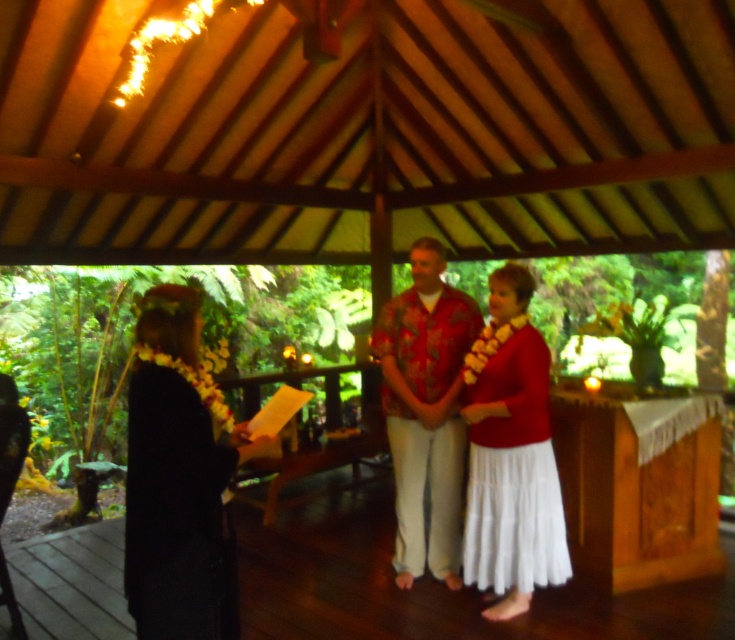
You are standing at the wooden pavilion and want to determine which of the two points, point (139, 572) or point (539, 371), is closer to you. Based on the scene description, which point is nearer?

Point (139, 572) is closer to the viewer than point (539, 371).

Based on the photo, you are attending a cultural ceremony at the wooden pavilion. You see two people wearing the black fabric dress at left and the hawaiian print shirt at center. Which one is positioned more to the left side of the scene?

The black fabric dress at left is positioned more to the left side of the scene compared to the hawaiian print shirt at center.

You are organizing a cultural event and need to arrange seating based on the space each attendee occupies. The black fabric dress at left and the hawaiian print shirt at center are two attendees. Which attendee requires more seating space?

Answer: The hawaiian print shirt at center requires more seating space because it occupies more space than the black fabric dress at left.